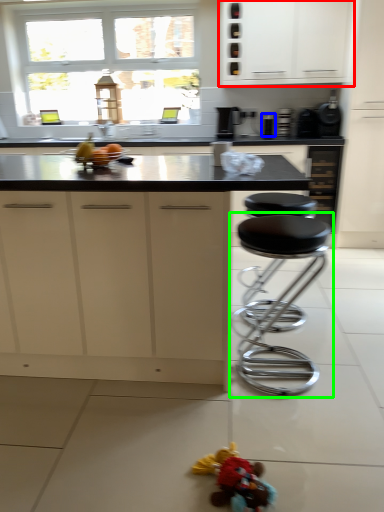
Question: Based on their relative distances, which object is nearer to cabinetry (highlighted by a red box)? Choose from appliance (highlighted by a blue box) and stool (highlighted by a green box).

Choices:
 (A) appliance
 (B) stool

Answer: (A)